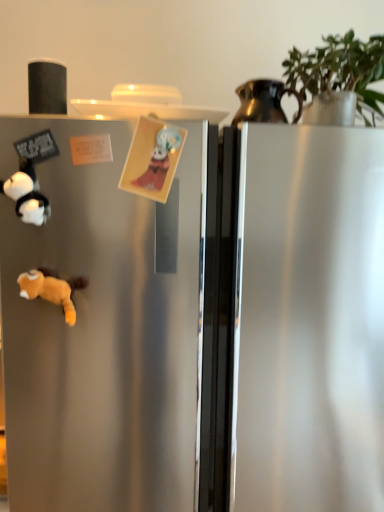
This screenshot has height=512, width=384. Identify the location of white plush panda at left, marked as the second toy in a right-to-left arrangement. (27, 194).

Identify the location of fluffy orange stuffed animal at lower left. The width and height of the screenshot is (384, 512). (51, 290).

Is metallic pitcher at upper right inside white plush panda at left, which ranks as the first toy in left-to-right order?

That's incorrect, metallic pitcher at upper right is not inside white plush panda at left, which ranks as the first toy in left-to-right order.

Can you tell me how much white plush panda at left, which ranks as the first toy in left-to-right order, and metallic pitcher at upper right differ in facing direction?

4.24 degrees separate the facing orientations of white plush panda at left, which ranks as the first toy in left-to-right order, and metallic pitcher at upper right.

Is white plush panda at left, marked as the second toy in a right-to-left arrangement, shorter than metallic pitcher at upper right?

Yes, white plush panda at left, marked as the second toy in a right-to-left arrangement, is shorter than metallic pitcher at upper right.

Are white plush panda at left, marked as the second toy in a right-to-left arrangement, and metallic pitcher at upper right located far from each other?

No, white plush panda at left, marked as the second toy in a right-to-left arrangement, is not far away from metallic pitcher at upper right.

Could you tell me if white plush panda at left, which ranks as the first toy in left-to-right order, is facing fluffy orange stuffed animal at lower left?

No, white plush panda at left, which ranks as the first toy in left-to-right order, is not aimed at fluffy orange stuffed animal at lower left.

From a real-world perspective, is white plush panda at left, marked as the second toy in a right-to-left arrangement, located beneath fluffy orange stuffed animal at lower left?

Incorrect, from a real-world perspective, white plush panda at left, marked as the second toy in a right-to-left arrangement, is higher than fluffy orange stuffed animal at lower left.

Between white plush panda at left, marked as the second toy in a right-to-left arrangement, and fluffy orange stuffed animal at lower left, which one is positioned in front?

white plush panda at left, marked as the second toy in a right-to-left arrangement, is more forward.

You are a GUI agent. You are given a task and a screenshot of the screen. Output one action in this format:
    pyautogui.click(x=<x>, y=<y>)
    Task: Click on the toy that is the 1st object located above the fluffy orange stuffed animal at lower left (from the image's perspective)
    
    Given the screenshot: What is the action you would take?
    pyautogui.click(x=27, y=194)

Considering the points (20, 208) and (174, 169), which point is in front, point (20, 208) or point (174, 169)?

The point (20, 208) is closer to the camera.

Which object is closer to the camera taking this photo, white plush panda at left, marked as the second toy in a right-to-left arrangement, or matte paper card at center, placed as the 1th toy when sorted from right to left?

white plush panda at left, marked as the second toy in a right-to-left arrangement, is in front.

Between white plush panda at left, which ranks as the first toy in left-to-right order, and matte paper card at center, placed as the 2th toy when sorted from left to right, which one appears on the right side from the viewer's perspective?

matte paper card at center, placed as the 2th toy when sorted from left to right.

Find the location of a particular element. The image size is (384, 512). toy that is above the white plush panda at left, which ranks as the first toy in left-to-right order (from the image's perspective) is located at coordinates (161, 160).

Considering the sizes of objects metallic pitcher at upper right and matte paper card at center, placed as the 1th toy when sorted from right to left, in the image provided, who is wider, metallic pitcher at upper right or matte paper card at center, placed as the 1th toy when sorted from right to left,?

With larger width is metallic pitcher at upper right.

From a real-world perspective, is metallic pitcher at upper right on top of matte paper card at center, placed as the 2th toy when sorted from left to right?

Yes.

Looking at this image, between metallic pitcher at upper right and matte paper card at center, placed as the 2th toy when sorted from left to right, which one appears on the left side from the viewer's perspective?

matte paper card at center, placed as the 2th toy when sorted from left to right.

Is metallic pitcher at upper right beside matte paper card at center, placed as the 2th toy when sorted from left to right?

metallic pitcher at upper right is not next to matte paper card at center, placed as the 2th toy when sorted from left to right, and they're not touching.

Looking at this image, which is more to the right, green matte plant at upper right or metallic pitcher at upper right?

From the viewer's perspective, green matte plant at upper right appears more on the right side.

Considering the relative positions of green matte plant at upper right and metallic pitcher at upper right in the image provided, is green matte plant at upper right in front of metallic pitcher at upper right?

Yes, the depth of green matte plant at upper right is less than that of metallic pitcher at upper right.

Is green matte plant at upper right not close to metallic pitcher at upper right?

No, green matte plant at upper right is not far away from metallic pitcher at upper right.

Between green matte plant at upper right and metallic pitcher at upper right, which one has less height?

With less height is metallic pitcher at upper right.

Can you confirm if metallic pitcher at upper right is bigger than white plush panda at left, marked as the second toy in a right-to-left arrangement?

Yes.

Considering the sizes of objects metallic pitcher at upper right and white plush panda at left, marked as the second toy in a right-to-left arrangement, in the image provided, who is taller, metallic pitcher at upper right or white plush panda at left, marked as the second toy in a right-to-left arrangement,?

With more height is metallic pitcher at upper right.

From a real-world perspective, does metallic pitcher at upper right stand above white plush panda at left, which ranks as the first toy in left-to-right order?

Yes, from a real-world perspective, metallic pitcher at upper right is over white plush panda at left, which ranks as the first toy in left-to-right order

How different are the orientations of fluffy orange stuffed animal at lower left and green matte plant at upper right in degrees?

There is a 7.52-degree angle between the facing directions of fluffy orange stuffed animal at lower left and green matte plant at upper right.

Does point (34, 291) appear closer or farther from the camera than point (335, 51)?

Point (34, 291) appears to be closer to the viewer than point (335, 51).

Based on the photo, between fluffy orange stuffed animal at lower left and green matte plant at upper right, which one has less height?

fluffy orange stuffed animal at lower left is shorter.

Is fluffy orange stuffed animal at lower left bigger than green matte plant at upper right?

No, fluffy orange stuffed animal at lower left is not bigger than green matte plant at upper right.

Identify the location of appliance positioned vertically above the white plush panda at left, which ranks as the first toy in left-to-right order (from a real-world perspective). (264, 102).

Identify the location of toy in front of the fluffy orange stuffed animal at lower left. The height and width of the screenshot is (512, 384). (27, 194).

When comparing their distances from fluffy orange stuffed animal at lower left, does white plush panda at left, marked as the second toy in a right-to-left arrangement, or green matte plant at upper right seem further?

green matte plant at upper right is positioned further to the anchor fluffy orange stuffed animal at lower left.

Looking at the image, which one is located closer to metallic pitcher at upper right, fluffy orange stuffed animal at lower left or green matte plant at upper right?

green matte plant at upper right lies closer to metallic pitcher at upper right than the other object.

Based on their spatial positions, is green matte plant at upper right or metallic pitcher at upper right closer to fluffy orange stuffed animal at lower left?

metallic pitcher at upper right.

From the image, which object appears to be farther from metallic pitcher at upper right, green matte plant at upper right or fluffy orange stuffed animal at lower left?

Based on the image, fluffy orange stuffed animal at lower left appears to be further to metallic pitcher at upper right.

Which object lies nearer to the anchor point green matte plant at upper right, fluffy orange stuffed animal at lower left or metallic pitcher at upper right?

metallic pitcher at upper right.

Considering their positions, is metallic pitcher at upper right positioned closer to white plush panda at left, which ranks as the first toy in left-to-right order, than green matte plant at upper right?

metallic pitcher at upper right.

Estimate the real-world distances between objects in this image. Which object is closer to fluffy orange stuffed animal at lower left, green matte plant at upper right or matte paper card at center, placed as the 1th toy when sorted from right to left?

matte paper card at center, placed as the 1th toy when sorted from right to left.

From the image, which object appears to be farther from white plush panda at left, marked as the second toy in a right-to-left arrangement, metallic pitcher at upper right or fluffy orange stuffed animal at lower left?

Based on the image, metallic pitcher at upper right appears to be further to white plush panda at left, marked as the second toy in a right-to-left arrangement.

This screenshot has width=384, height=512. Find the location of `animal between white plush panda at left, marked as the second toy in a right-to-left arrangement, and metallic pitcher at upper right, in the horizontal direction`. animal between white plush panda at left, marked as the second toy in a right-to-left arrangement, and metallic pitcher at upper right, in the horizontal direction is located at coordinates pyautogui.click(x=51, y=290).

You are a GUI agent. You are given a task and a screenshot of the screen. Output one action in this format:
    pyautogui.click(x=<x>, y=<y>)
    Task: Click on the toy situated between fluffy orange stuffed animal at lower left and metallic pitcher at upper right from left to right
    The image size is (384, 512).
    Given the screenshot: What is the action you would take?
    pyautogui.click(x=161, y=160)

Locate an element on the screen. This screenshot has width=384, height=512. toy between fluffy orange stuffed animal at lower left and green matte plant at upper right is located at coordinates (161, 160).

Locate an element on the screen. toy that lies between matte paper card at center, placed as the 1th toy when sorted from right to left, and fluffy orange stuffed animal at lower left from top to bottom is located at coordinates (27, 194).